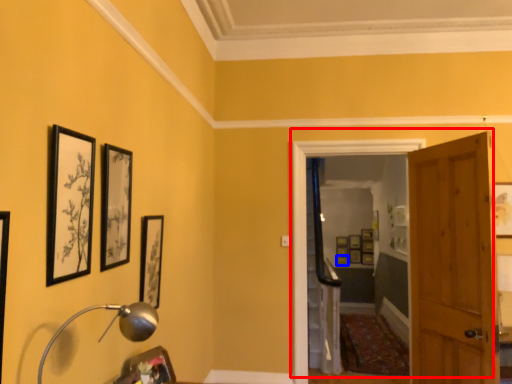
Question: Which object is closer to the camera taking this photo, door (highlighted by a red box) or picture frame (highlighted by a blue box)?

Choices:
 (A) door
 (B) picture frame

Answer: (A)